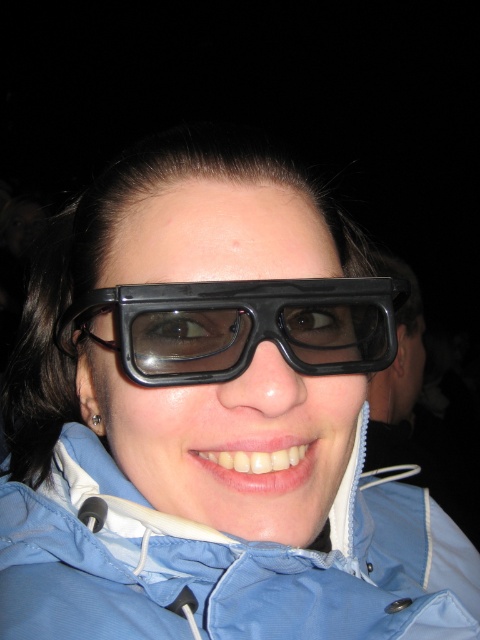
Question: Is blue fabric jacket at lower center further to camera compared to black plastic goggles at center?

Choices:
 (A) yes
 (B) no

Answer: (A)

Question: Can you confirm if blue fabric jacket at lower center is positioned to the left of black plastic goggles at center?

Choices:
 (A) yes
 (B) no

Answer: (B)

Question: Is blue fabric jacket at lower center behind black plastic goggles at center?

Choices:
 (A) no
 (B) yes

Answer: (B)

Question: Among these points, which one is nearest to the camera?

Choices:
 (A) (262, 332)
 (B) (276, 627)

Answer: (A)